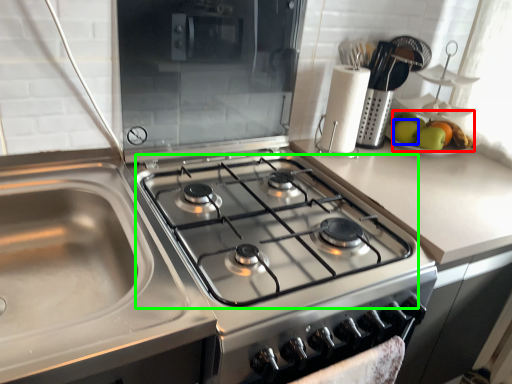
Question: Which object is positioned closest to apple (highlighted by a red box)? Select from apple (highlighted by a blue box) and gas stove (highlighted by a green box).

Choices:
 (A) apple
 (B) gas stove

Answer: (A)